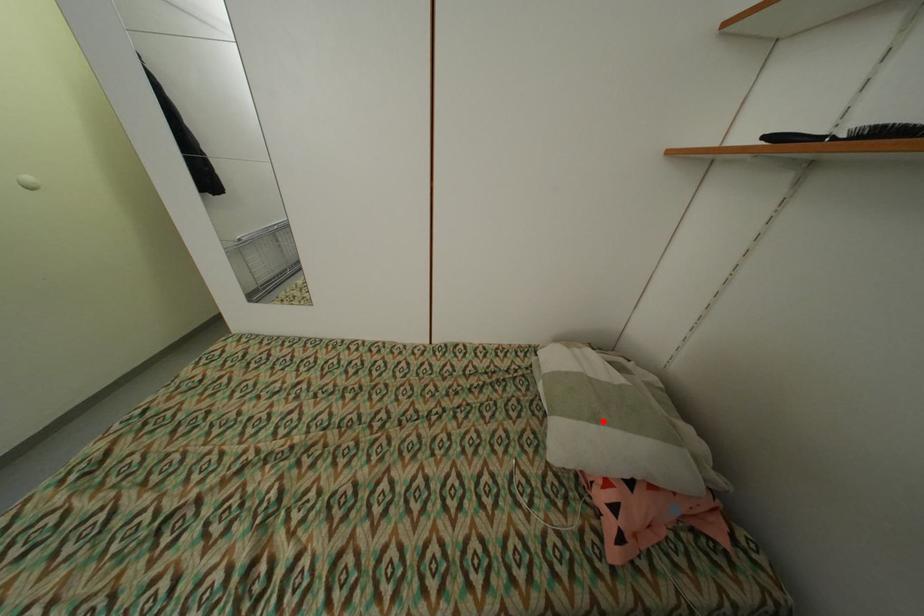
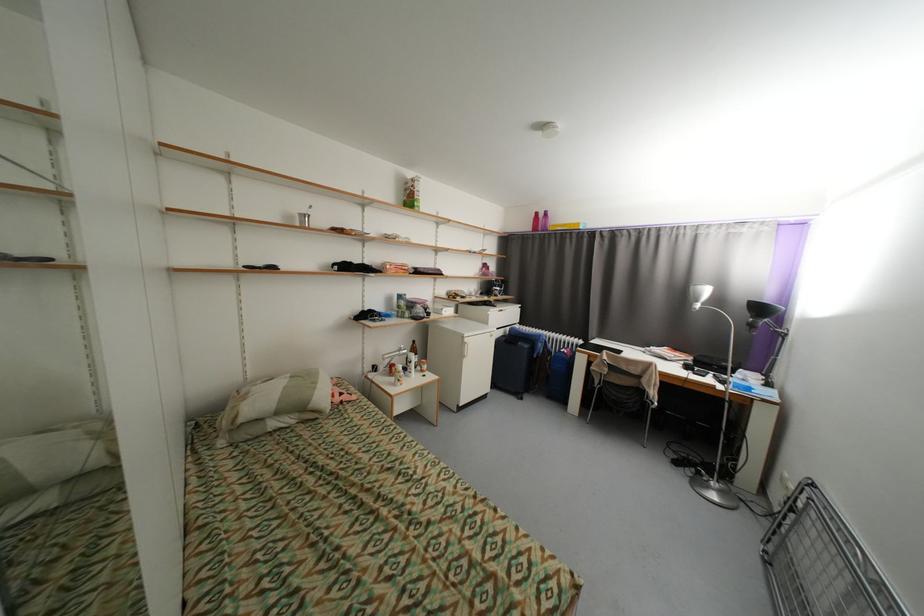
Question: I am providing you with two images of the same scene from different viewpoints. Given a red point in image1, look at the same physical point in image2. Is it:

Choices:
 (A) Closer to the viewpoint
 (B) Farther from the viewpoint

Answer: (A)